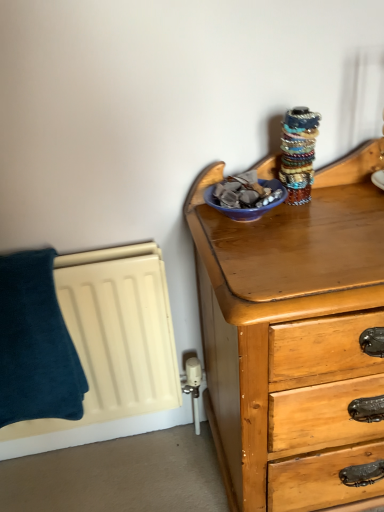
Describe the element at coordinates (35, 344) in the screenshot. I see `dark blue plush towel at left` at that location.

Where is `dark blue plush towel at left`? This screenshot has height=512, width=384. dark blue plush towel at left is located at coordinates (35, 344).

Describe the element at coordinates (246, 208) in the screenshot. This screenshot has height=512, width=384. I see `blue glossy bowl at upper right` at that location.

Image resolution: width=384 pixels, height=512 pixels. Find the location of `blue glossy bowl at upper right`. blue glossy bowl at upper right is located at coordinates (246, 208).

The height and width of the screenshot is (512, 384). In order to click on dark blue plush towel at left in this screenshot , I will do `click(35, 344)`.

Does blue glossy bowl at upper right appear on the right side of dark blue plush towel at left?

Correct, you'll find blue glossy bowl at upper right to the right of dark blue plush towel at left.

Is blue glossy bowl at upper right positioned in front of dark blue plush towel at left?

Yes, the depth of blue glossy bowl at upper right is less than that of dark blue plush towel at left.

Does point (285, 195) appear closer or farther from the camera than point (7, 322)?

Point (285, 195) is closer to the camera than point (7, 322).

From the image's perspective, between blue glossy bowl at upper right and dark blue plush towel at left, who is located below?

dark blue plush towel at left appears lower in the image.

From the picture: From a real-world perspective, is blue glossy bowl at upper right physically above dark blue plush towel at left?

Yes, from a real-world perspective, blue glossy bowl at upper right is over dark blue plush towel at left

Between blue glossy bowl at upper right and dark blue plush towel at left, which one has larger width?

Wider between the two is dark blue plush towel at left.

Considering the relative sizes of blue glossy bowl at upper right and dark blue plush towel at left in the image provided, is blue glossy bowl at upper right taller than dark blue plush towel at left?

No, blue glossy bowl at upper right is not taller than dark blue plush towel at left.

Can you confirm if blue glossy bowl at upper right is bigger than dark blue plush towel at left?

Incorrect, blue glossy bowl at upper right is not larger than dark blue plush towel at left.

Is blue glossy bowl at upper right situated inside dark blue plush towel at left or outside?

blue glossy bowl at upper right is not inside dark blue plush towel at left, it's outside.

Are blue glossy bowl at upper right and dark blue plush towel at left beside each other?

No, blue glossy bowl at upper right is not touching dark blue plush towel at left.

Does blue glossy bowl at upper right turn towards dark blue plush towel at left?

No, blue glossy bowl at upper right does not turn towards dark blue plush towel at left.

How different are the orientations of blue glossy bowl at upper right and dark blue plush towel at left in degrees?

There is a 0.774-degree angle between the facing directions of blue glossy bowl at upper right and dark blue plush towel at left.

Measure the distance from blue glossy bowl at upper right to dark blue plush towel at left.

blue glossy bowl at upper right is 22.21 inches from dark blue plush towel at left.

In the image, there is a blue glossy bowl at upper right. Identify the location of pillow below it (from a real-world perspective). (35, 344).

Would you say dark blue plush towel at left is to the left or to the right of blue glossy bowl at upper right in the picture?

In the image, dark blue plush towel at left appears on the left side of blue glossy bowl at upper right.

Considering the positions of objects dark blue plush towel at left and blue glossy bowl at upper right in the image provided, who is in front, dark blue plush towel at left or blue glossy bowl at upper right?

blue glossy bowl at upper right is closer to the camera.

Considering the positions of points (20, 252) and (231, 215), is point (20, 252) farther from camera compared to point (231, 215)?

Yes.

From the image's perspective, is dark blue plush towel at left beneath blue glossy bowl at upper right?

Yes.

From a real-world perspective, is dark blue plush towel at left above or below blue glossy bowl at upper right?

dark blue plush towel at left is situated lower than blue glossy bowl at upper right in the real world.

Which object is wider, dark blue plush towel at left or blue glossy bowl at upper right?

dark blue plush towel at left is wider.

In terms of height, does dark blue plush towel at left look taller or shorter compared to blue glossy bowl at upper right?

Considering their sizes, dark blue plush towel at left has more height than blue glossy bowl at upper right.

Can you confirm if dark blue plush towel at left is smaller than blue glossy bowl at upper right?

Actually, dark blue plush towel at left might be larger than blue glossy bowl at upper right.

Is blue glossy bowl at upper right completely or partially inside dark blue plush towel at left?

No, blue glossy bowl at upper right is not surrounded by dark blue plush towel at left.

Is dark blue plush towel at left not near blue glossy bowl at upper right?

No, dark blue plush towel at left is in close proximity to blue glossy bowl at upper right.

Is dark blue plush towel at left aimed at blue glossy bowl at upper right?

No, dark blue plush towel at left is not aimed at blue glossy bowl at upper right.

What's the angular difference between dark blue plush towel at left and blue glossy bowl at upper right's facing directions?

They differ by 0.774 degrees in their facing directions.

I want to click on glass bowl on the right of dark blue plush towel at left, so click(x=246, y=208).

Locate an element on the screen. glass bowl that is on the right side of dark blue plush towel at left is located at coordinates (246, 208).

Locate an element on the screen. The height and width of the screenshot is (512, 384). glass bowl lying above the dark blue plush towel at left (from the image's perspective) is located at coordinates (246, 208).